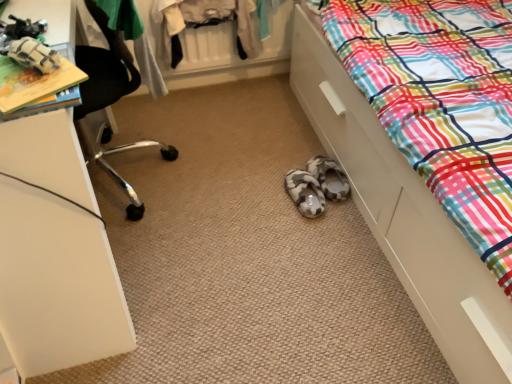
Question: Should I look upward or downward to see multicolored plaid fabric at lower right?

Choices:
 (A) up
 (B) down

Answer: (A)

Question: Can you confirm if multicolored plaid fabric at lower right is thinner than black mesh chair at upper left?

Choices:
 (A) yes
 (B) no

Answer: (B)

Question: Is multicolored plaid fabric at lower right to the right of black mesh chair at upper left from the viewer's perspective?

Choices:
 (A) no
 (B) yes

Answer: (B)

Question: Is black mesh chair at upper left inside multicolored plaid fabric at lower right?

Choices:
 (A) yes
 (B) no

Answer: (B)

Question: Can you confirm if multicolored plaid fabric at lower right is shorter than black mesh chair at upper left?

Choices:
 (A) no
 (B) yes

Answer: (A)

Question: Is multicolored plaid fabric at lower right oriented away from black mesh chair at upper left?

Choices:
 (A) no
 (B) yes

Answer: (A)

Question: From a real-world perspective, is multicolored plaid fabric at lower right over black mesh chair at upper left?

Choices:
 (A) yes
 (B) no

Answer: (B)

Question: From a real-world perspective, is black mesh chair at upper left over multicolored plaid fabric at lower right?

Choices:
 (A) no
 (B) yes

Answer: (B)

Question: Can you confirm if black mesh chair at upper left is wider than multicolored plaid fabric at lower right?

Choices:
 (A) yes
 (B) no

Answer: (B)

Question: Is black mesh chair at upper left taller than multicolored plaid fabric at lower right?

Choices:
 (A) yes
 (B) no

Answer: (B)

Question: From the image's perspective, is black mesh chair at upper left above multicolored plaid fabric at lower right?

Choices:
 (A) no
 (B) yes

Answer: (B)

Question: Could you tell me if black mesh chair at upper left is facing multicolored plaid fabric at lower right?

Choices:
 (A) no
 (B) yes

Answer: (B)

Question: From a real-world perspective, is black mesh chair at upper left below multicolored plaid fabric at lower right?

Choices:
 (A) no
 (B) yes

Answer: (A)

Question: From a real-world perspective, is multicolored plaid fabric at lower right above or below black mesh chair at upper left?

Choices:
 (A) above
 (B) below

Answer: (B)